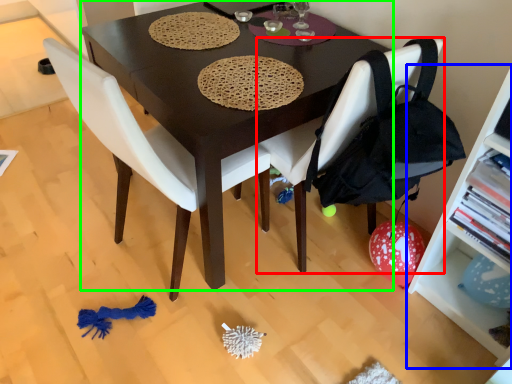
Question: Which object is the closest to the chair (highlighted by a red box)? Choose among these: shelf (highlighted by a blue box) or desk (highlighted by a green box).

Choices:
 (A) shelf
 (B) desk

Answer: (B)